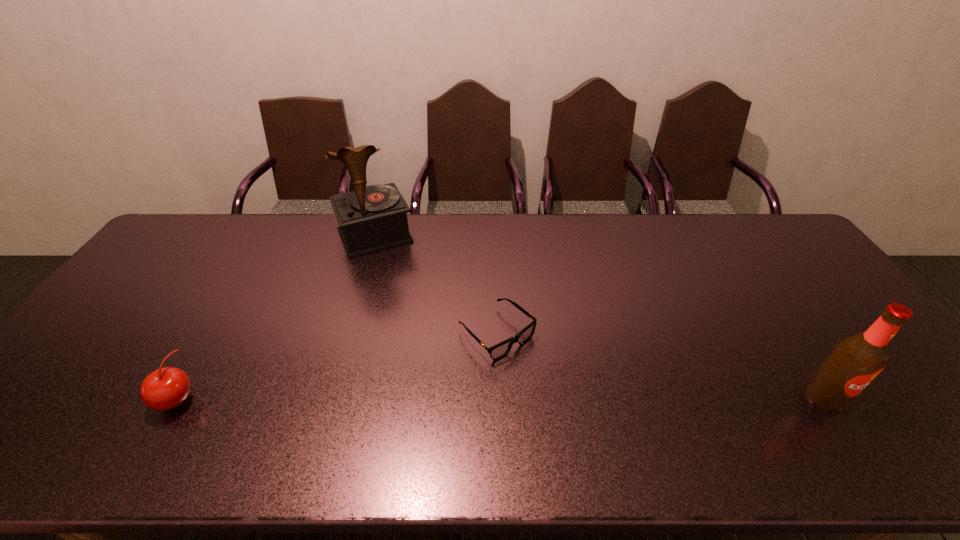
Where is `free location at the near edge`? This screenshot has width=960, height=540. free location at the near edge is located at coordinates (708, 407).

The image size is (960, 540). What are the coordinates of `vacant position at the right edge of the desktop` in the screenshot? It's located at (770, 262).

Find the location of a particular element. free space at the far left corner of the desktop is located at coordinates (202, 221).

Find the location of a particular element. This screenshot has width=960, height=540. vacant space at the far right corner of the desktop is located at coordinates (757, 230).

Where is `free space between the beer bottle and the farthest object`? The width and height of the screenshot is (960, 540). free space between the beer bottle and the farthest object is located at coordinates (599, 316).

Locate an element on the screen. empty space that is in between the shortest object and the cherry is located at coordinates (337, 366).

The height and width of the screenshot is (540, 960). I want to click on vacant space that's between the leftmost object and the third object from left to right, so click(337, 366).

Identify the location of vacant point located between the leftmost object and the beer bottle. (501, 397).

In order to click on empty space that is in between the third object from left to right and the tallest object in this screenshot , I will do `click(436, 285)`.

Where is `free spot between the cherry and the rightmost object`? The width and height of the screenshot is (960, 540). free spot between the cherry and the rightmost object is located at coordinates (501, 397).